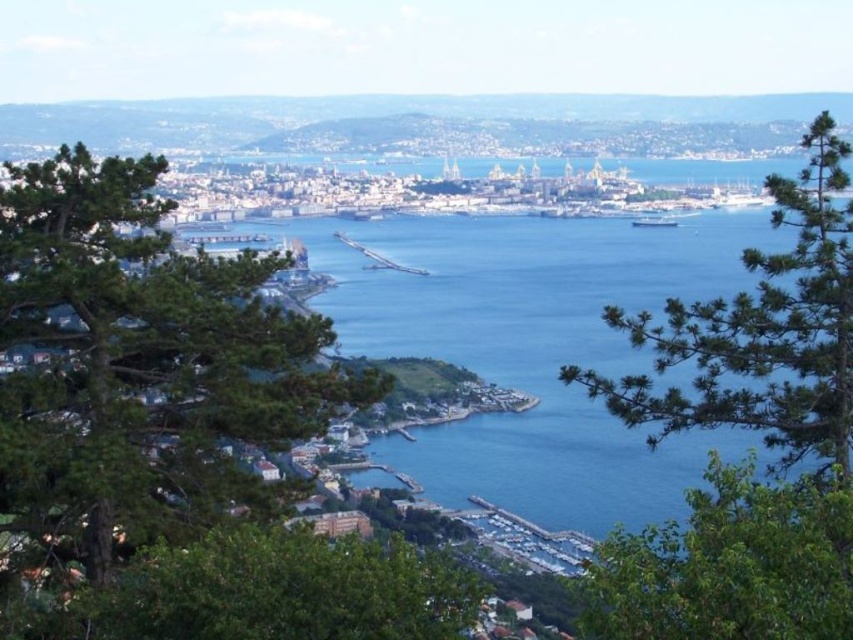
You are standing at the point marked by the coordinates point (141, 365) in the coastal cityscape. Looking towards the green leafy tree at left, which direction should you face to see the harbor area in the middle ground?

Since the green leafy tree at left is located at point (141, 365), facing away from the tree would orient you towards the middle ground harbor area. Therefore, you should face opposite the green leafy tree at left to see the harbor area in the middle ground.

You are standing at the top of the hill and looking at the green leafy tree at center and the green leafy tree at lower right. Which tree is closer to you?

The green leafy tree at center is closer to you because the green leafy tree at lower right is behind it.

You are a photographer standing on a hillside overlooking the coastal city. You notice the green leafy tree at left and the blue metallic ship at center in your viewfinder. Which object appears closer to you in the scene?

The green leafy tree at left appears closer to you because it is positioned below the blue metallic ship at center, indicating it is in the foreground of the scene.